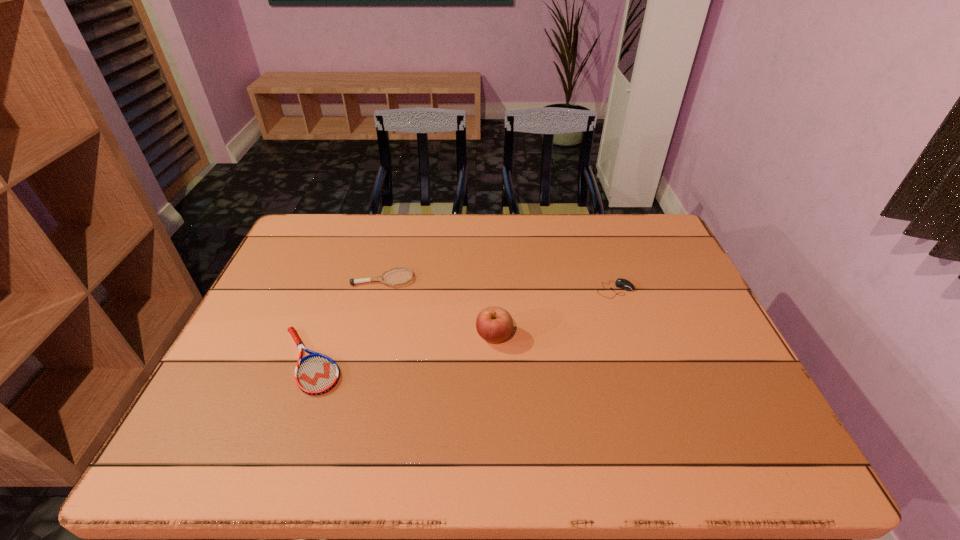
Locate an element on the screen. The height and width of the screenshot is (540, 960). the tallest object is located at coordinates (494, 324).

Identify the location of apple. This screenshot has width=960, height=540. (494, 324).

Locate an element on the screen. The image size is (960, 540). the farther tennis racket is located at coordinates (378, 278).

The width and height of the screenshot is (960, 540). In order to click on computer mouse in this screenshot , I will do `click(621, 283)`.

Where is `the shortest object`? the shortest object is located at coordinates (315, 374).

What are the coordinates of `the nearer tennis racket` in the screenshot? It's located at (315, 374).

At what (x,y) coordinates should I click in order to perform the action: click on free space located on the front of the tallest object. Please return your answer as a coordinate pair (x, y). Image resolution: width=960 pixels, height=540 pixels. Looking at the image, I should click on (497, 418).

The height and width of the screenshot is (540, 960). I want to click on blank space located 0.180m on the front of the taller tennis racket, so click(x=369, y=335).

Where is `vacant space situated on the left of the computer mouse`? The width and height of the screenshot is (960, 540). vacant space situated on the left of the computer mouse is located at coordinates (476, 289).

This screenshot has width=960, height=540. In order to click on blank area located 0.050m on the back of the nearer tennis racket in this screenshot , I will do [326, 316].